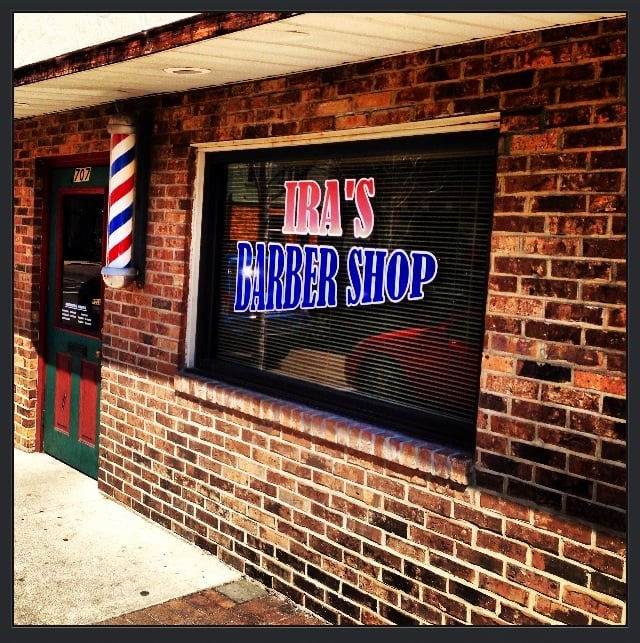
The height and width of the screenshot is (643, 640). I want to click on white windowsill, so click(x=196, y=197), click(x=344, y=134).